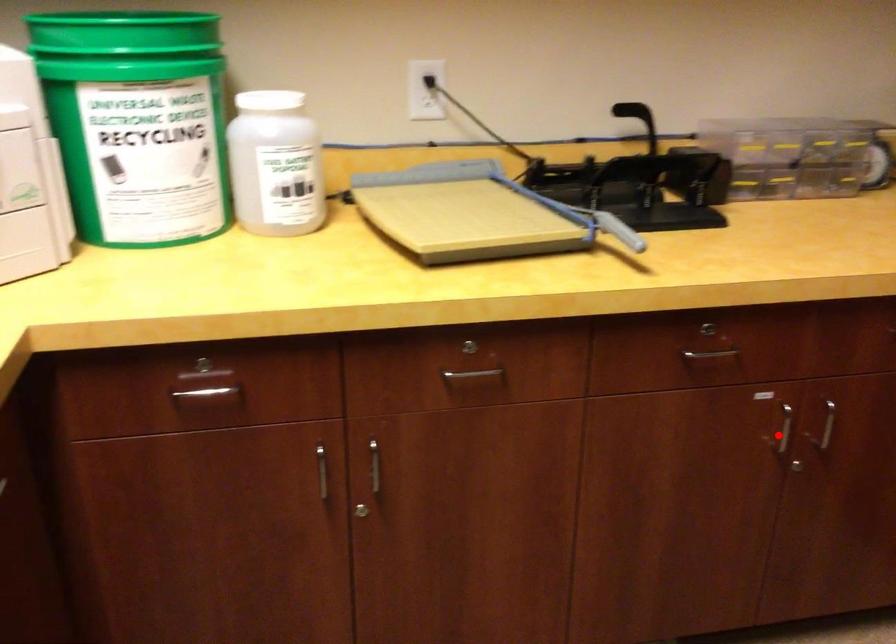
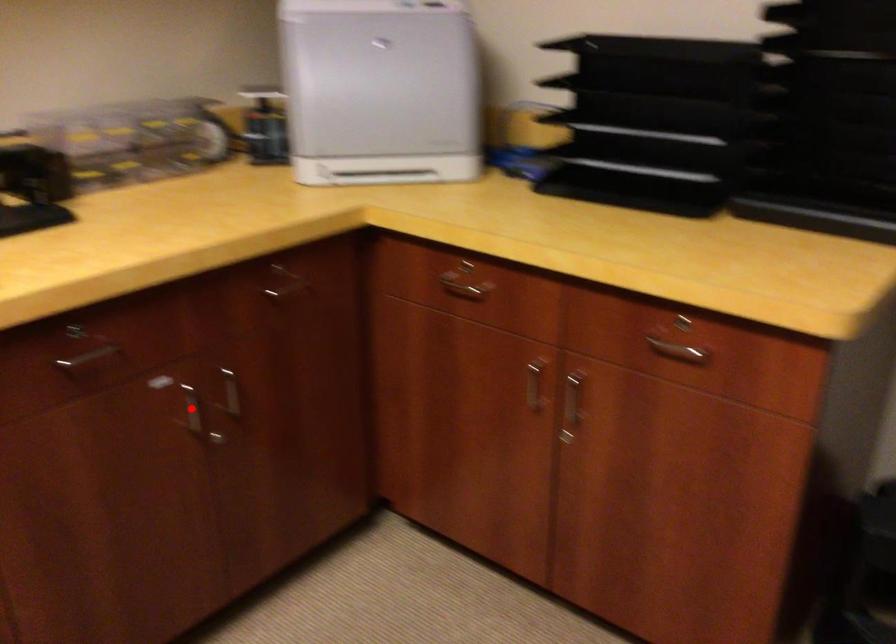
I am providing you with two images of the same scene from different viewpoints. A red point is marked on the first image and another point is marked on the second image. Is the red point in image1 aligned with the point shown in image2?

Yes